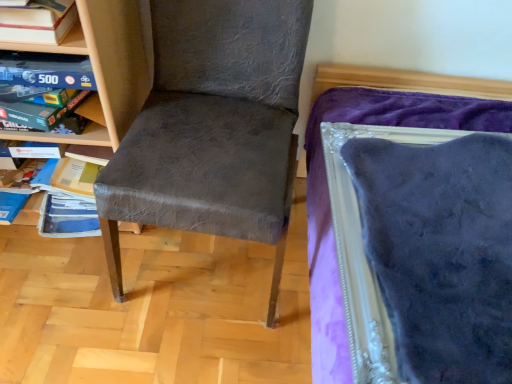
Identify the location of wooden board game at upper left, which ranks as the 1th shelf in back-to-front order. coord(66,136).

Image resolution: width=512 pixels, height=384 pixels. I want to click on matte gray chair at center, so click(213, 128).

I want to click on wooden board game at upper left, which ranks as the 1th shelf in back-to-front order, so [66, 136].

Between wooden board game at upper left, which ranks as the 1th shelf in back-to-front order, and wooden bookshelf at left, which is counted as the first shelf, starting from the front, which one appears on the right side from the viewer's perspective?

Positioned to the right is wooden board game at upper left, which ranks as the 1th shelf in back-to-front order.

Considering the relative sizes of wooden board game at upper left, which ranks as the 1th shelf in back-to-front order, and wooden bookshelf at left, which is counted as the first shelf, starting from the front, in the image provided, is wooden board game at upper left, which ranks as the 1th shelf in back-to-front order, bigger than wooden bookshelf at left, which is counted as the first shelf, starting from the front,?

No, wooden board game at upper left, which ranks as the 1th shelf in back-to-front order, is not bigger than wooden bookshelf at left, which is counted as the first shelf, starting from the front.

How different are the orientations of wooden board game at upper left, the second shelf positioned from the front, and wooden bookshelf at left, which is counted as the 2th shelf, starting from the back, in degrees?

wooden board game at upper left, the second shelf positioned from the front, and wooden bookshelf at left, which is counted as the 2th shelf, starting from the back, are facing 1.2 degrees away from each other.

The image size is (512, 384). I want to click on shelf in front of the wooden board game at upper left, the second shelf positioned from the front, so click(105, 66).

From their relative heights in the image, would you say wooden bookshelf at left, which is counted as the 2th shelf, starting from the back, is taller or shorter than wooden board game at upper left, which ranks as the 1th shelf in back-to-front order?

In the image, wooden bookshelf at left, which is counted as the 2th shelf, starting from the back, appears to be taller than wooden board game at upper left, which ranks as the 1th shelf in back-to-front order.

Would you say wooden bookshelf at left, which is counted as the 2th shelf, starting from the back, is to the left or to the right of wooden board game at upper left, which ranks as the 1th shelf in back-to-front order, in the picture?

In the image, wooden bookshelf at left, which is counted as the 2th shelf, starting from the back, appears on the left side of wooden board game at upper left, which ranks as the 1th shelf in back-to-front order.

From a real-world perspective, between wooden bookshelf at left, which is counted as the 2th shelf, starting from the back, and wooden board game at upper left, which ranks as the 1th shelf in back-to-front order, who is vertically lower?

wooden bookshelf at left, which is counted as the 2th shelf, starting from the back, is physically lower.

Is wooden bookshelf at left, which is counted as the 2th shelf, starting from the back, in front of or behind matte gray chair at center in the image?

wooden bookshelf at left, which is counted as the 2th shelf, starting from the back, is positioned farther from the viewer than matte gray chair at center.

From the picture: Would you consider wooden bookshelf at left, which is counted as the 2th shelf, starting from the back, to be distant from matte gray chair at center?

That's not correct — wooden bookshelf at left, which is counted as the 2th shelf, starting from the back, is a little close to matte gray chair at center.

Does wooden bookshelf at left, which is counted as the 2th shelf, starting from the back, have a larger size compared to matte gray chair at center?

Incorrect, wooden bookshelf at left, which is counted as the 2th shelf, starting from the back, is not larger than matte gray chair at center.

Is wooden bookshelf at left, which is counted as the 2th shelf, starting from the back, taller than matte gray chair at center?

No.

From the image's perspective, is wooden board game at upper left, the second shelf positioned from the front, located above or below matte gray chair at center?

Based on their image positions, wooden board game at upper left, the second shelf positioned from the front, is located above matte gray chair at center.

Who is more distant, wooden board game at upper left, the second shelf positioned from the front, or matte gray chair at center?

wooden board game at upper left, the second shelf positioned from the front, is behind.

This screenshot has height=384, width=512. What are the coordinates of `shelf above the matte gray chair at center (from a real-world perspective)` in the screenshot? It's located at (66, 136).

Between point (102, 87) and point (287, 32), which one is positioned behind?

The point (287, 32) is more distant.

Between matte gray chair at center and wooden board game at upper left, the second shelf positioned from the front, which one has larger width?

matte gray chair at center is wider.

Does matte gray chair at center have a larger size compared to wooden board game at upper left, which ranks as the 1th shelf in back-to-front order?

Indeed, matte gray chair at center has a larger size compared to wooden board game at upper left, which ranks as the 1th shelf in back-to-front order.

Would you say matte gray chair at center is to the left or to the right of wooden board game at upper left, the second shelf positioned from the front, in the picture?

Based on their positions, matte gray chair at center is located to the right of wooden board game at upper left, the second shelf positioned from the front.

Is point (271, 190) closer to camera compared to point (131, 9)?

Yes, it is.

Does matte gray chair at center have a larger size compared to wooden bookshelf at left, which is counted as the 2th shelf, starting from the back?

Correct, matte gray chair at center is larger in size than wooden bookshelf at left, which is counted as the 2th shelf, starting from the back.

Is matte gray chair at center closer to the viewer compared to wooden bookshelf at left, which is counted as the first shelf, starting from the front?

→ Yes.

Where is `shelf beneath the matte gray chair at center (from a real-world perspective)`? The height and width of the screenshot is (384, 512). shelf beneath the matte gray chair at center (from a real-world perspective) is located at coordinates (105, 66).

Locate an element on the screen. The height and width of the screenshot is (384, 512). shelf in front of the wooden board game at upper left, the second shelf positioned from the front is located at coordinates (105, 66).

Identify the location of shelf directly beneath the wooden board game at upper left, the second shelf positioned from the front (from a real-world perspective). The width and height of the screenshot is (512, 384). (105, 66).

When comparing their distances from wooden board game at upper left, which ranks as the 1th shelf in back-to-front order, does matte gray chair at center or wooden bookshelf at left, which is counted as the first shelf, starting from the front, seem closer?

wooden bookshelf at left, which is counted as the first shelf, starting from the front, is positioned closer to the anchor wooden board game at upper left, which ranks as the 1th shelf in back-to-front order.

Estimate the real-world distances between objects in this image. Which object is closer to matte gray chair at center, wooden bookshelf at left, which is counted as the 2th shelf, starting from the back, or wooden board game at upper left, which ranks as the 1th shelf in back-to-front order?

wooden bookshelf at left, which is counted as the 2th shelf, starting from the back, lies closer to matte gray chair at center than the other object.

Looking at this image, estimate the real-world distances between objects in this image. Which object is closer to wooden bookshelf at left, which is counted as the first shelf, starting from the front, wooden board game at upper left, the second shelf positioned from the front, or matte gray chair at center?

wooden board game at upper left, the second shelf positioned from the front, lies closer to wooden bookshelf at left, which is counted as the first shelf, starting from the front, than the other object.

Based on their spatial positions, is wooden bookshelf at left, which is counted as the first shelf, starting from the front, or matte gray chair at center further from wooden board game at upper left, which ranks as the 1th shelf in back-to-front order?

matte gray chair at center is further to wooden board game at upper left, which ranks as the 1th shelf in back-to-front order.

Estimate the real-world distances between objects in this image. Which object is closer to matte gray chair at center, wooden board game at upper left, which ranks as the 1th shelf in back-to-front order, or wooden bookshelf at left, which is counted as the 2th shelf, starting from the back?

wooden bookshelf at left, which is counted as the 2th shelf, starting from the back, is positioned closer to the anchor matte gray chair at center.

From the image, which object appears to be farther from wooden bookshelf at left, which is counted as the 2th shelf, starting from the back, matte gray chair at center or wooden board game at upper left, the second shelf positioned from the front?

matte gray chair at center is positioned further to the anchor wooden bookshelf at left, which is counted as the 2th shelf, starting from the back.

Identify the location of shelf between wooden bookshelf at left, which is counted as the 2th shelf, starting from the back, and matte gray chair at center. click(66, 136).